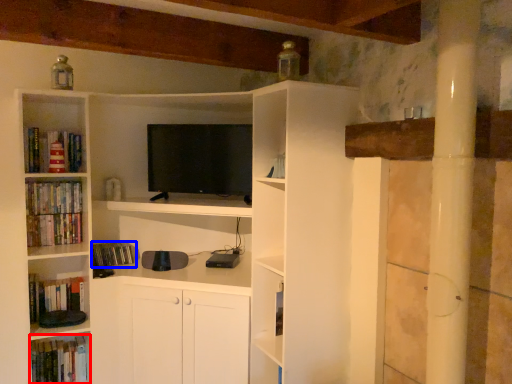
Question: Which of the following is the closest to the observer, book (highlighted by a red box) or book (highlighted by a blue box)?

Choices:
 (A) book
 (B) book

Answer: (A)